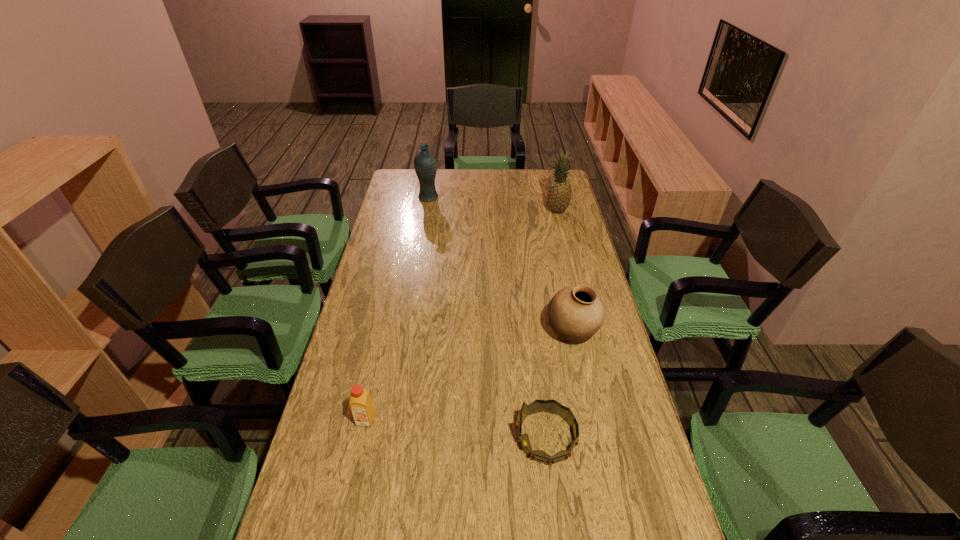
At what (x,y) coordinates should I click in order to perform the action: click on the third closest object to the pottery. Please return your answer as a coordinate pair (x, y). This screenshot has height=540, width=960. Looking at the image, I should click on (559, 194).

Select which object appears as the third closest to the third tallest object. Please provide its 2D coordinates. Your answer should be formatted as a tuple, i.e. [(x, y)], where the tuple contains the x and y coordinates of a point satisfying the conditions above.

[(559, 194)]

At what (x,y) coordinates should I click in order to perform the action: click on blank area in the image that satisfies the following two spatial constraints: 1. on the back side of the third nearest object; 2. on the right side of the second farthest object. Please return your answer as a coordinate pair (x, y). This screenshot has height=540, width=960. Looking at the image, I should click on (546, 211).

I want to click on vacant space that satisfies the following two spatial constraints: 1. on the front side of the second farthest object; 2. at the front of the shortest object with jewels, so click(x=612, y=436).

Locate an element on the screen. vacant space that satisfies the following two spatial constraints: 1. on the front side of the pineapple; 2. on the right side of the vase is located at coordinates click(x=426, y=211).